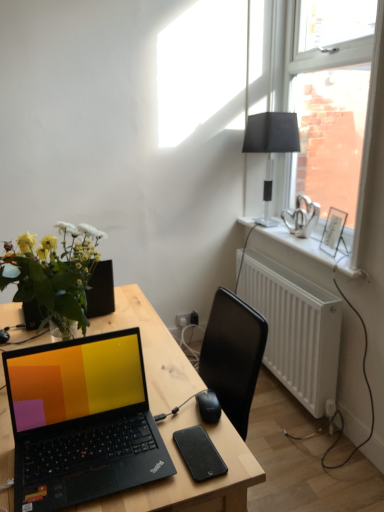
Question: From the image's perspective, is white plastic radiator at lower right located above or below black plastic mouse at center?

Choices:
 (A) above
 (B) below

Answer: (B)

Question: From their relative heights in the image, would you say white plastic radiator at lower right is taller or shorter than black plastic mouse at center?

Choices:
 (A) short
 (B) tall

Answer: (B)

Question: Based on their relative distances, which object is nearer to the white painted wood at upper right?

Choices:
 (A) black matte lampshade at upper right
 (B) white plastic radiator at lower right
 (C) black plastic mouse at center
 (D) black wood desk at center
 (E) black matte tablet at center

Answer: (B)

Question: Based on their relative distances, which object is farther from the black matte tablet at center?

Choices:
 (A) white plastic radiator at lower right
 (B) black matte lampshade at upper right
 (C) white painted wood at upper right
 (D) black plastic mouse at center
 (E) black wood desk at center

Answer: (B)